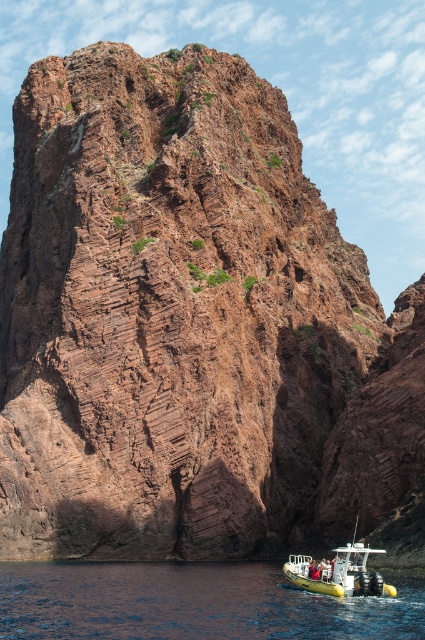
You are standing on the dock and see both the blue rubber boat at lower right and the yellow rubber boat at lower center. Which boat is positioned to the left when facing the water?

The blue rubber boat at lower right is positioned to the left of the yellow rubber boat at lower center.

You are a hiker who wants to take a boat ride. You see a blue rubber boat at lower right and a yellow rubber boat at lower center. Which boat is closer to the base of the towering red rock formation?

The blue rubber boat at lower right is positioned under the yellow rubber boat at lower center, so the blue rubber boat at lower right is closer to the base of the towering red rock formation.

You are a photographer planning to capture both the blue rubber boat at lower right and the yellow rubber boat at lower center in a single frame. Given their sizes, which boat should you position closer to the camera to ensure both appear roughly the same size in the photo?

To make both the blue rubber boat at lower right and the yellow rubber boat at lower center appear roughly the same size in the photo, you should position the smaller yellow rubber boat at lower center closer to the camera since the blue rubber boat at lower right is wider. This adjustment balances their apparent sizes despite their actual size difference.